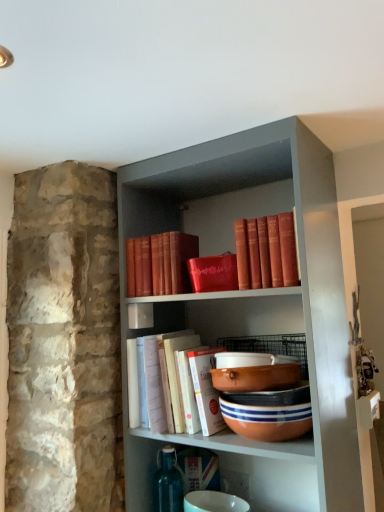
Question: Looking at the image, does terracotta clay bowl at center, positioned as the 3th bowl in top-to-bottom order, seem bigger or smaller compared to terracotta clay bowl at center, arranged as the second bowl when ordered from the bottom?

Choices:
 (A) big
 (B) small

Answer: (A)

Question: Is terracotta clay bowl at center, the 1th bowl when ordered from bottom to top, inside the boundaries of terracotta clay bowl at center, which is the 2th bowl in top-to-bottom order, or outside?

Choices:
 (A) inside
 (B) outside

Answer: (B)

Question: Which object is positioned closest to the terracotta clay bowl at center, arranged as the second bowl when ordered from the bottom?

Choices:
 (A) terracotta clay bowl at center, positioned as the 3th bowl in top-to-bottom order
 (B) matte red book at upper center, the second book from the top
 (C) red leather book at upper center, arranged as the 1th book when viewed from the top
 (D) matte orange bowl at center, which is counted as the 3th bowl, starting from the bottom
 (E) white paper book at center, marked as the 1th book in a bottom-to-top arrangement

Answer: (D)

Question: Which is farther from the matte red book at upper center, the second book from the top?

Choices:
 (A) matte orange bowl at center, which is the first bowl from top to bottom
 (B) terracotta clay bowl at center, positioned as the 3th bowl in top-to-bottom order
 (C) terracotta clay bowl at center, which is the 2th bowl in top-to-bottom order
 (D) red leather book at upper center, arranged as the 1th book when viewed from the top
 (E) white paper book at center, the third book positioned from the top

Answer: (B)